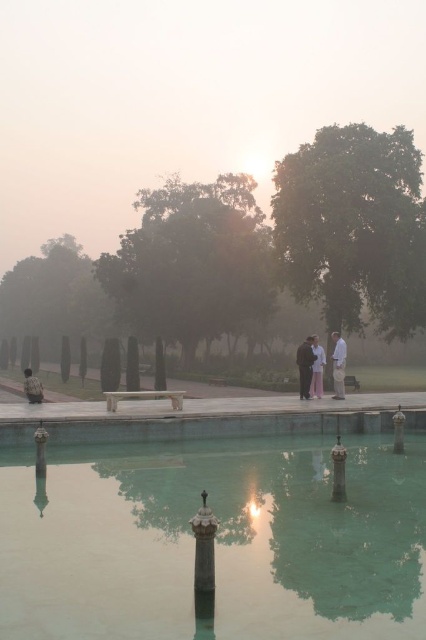
Is light pink fabric couple at center closer to the viewer compared to rain-soaked jacket at lower center?

No.

Locate an element on the screen. The image size is (426, 640). light pink fabric couple at center is located at coordinates pos(339,364).

The width and height of the screenshot is (426, 640). In order to click on light pink fabric couple at center in this screenshot , I will do `click(339, 364)`.

Can you confirm if green marble swimming pool at center is positioned below white cotton pants at center?

Yes, green marble swimming pool at center is below white cotton pants at center.

Who is positioned more to the right, green marble swimming pool at center or white cotton pants at center?

From the viewer's perspective, white cotton pants at center appears more on the right side.

Identify the location of green marble swimming pool at center. This screenshot has width=426, height=640. (215, 540).

What are the coordinates of `green marble swimming pool at center` in the screenshot? It's located at (215, 540).

Which is above, green marble swimming pool at center or rain-soaked jacket at lower center?

rain-soaked jacket at lower center

Describe the element at coordinates (215, 540) in the screenshot. I see `green marble swimming pool at center` at that location.

At what (x,y) coordinates should I click in order to perform the action: click on green marble swimming pool at center. Please return your answer as a coordinate pair (x, y). The image size is (426, 640). Looking at the image, I should click on (215, 540).